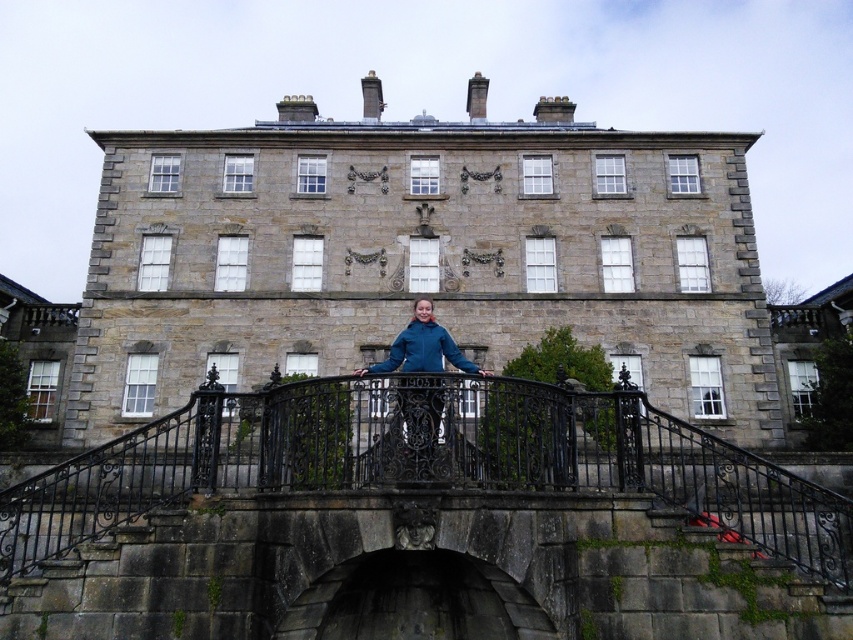
Looking at this image, which of these two, black wrought iron bridge at center or blue fabric jacket at center, stands shorter?

Standing shorter between the two is blue fabric jacket at center.

Who is more forward, (526,444) or (404,340)?

Positioned in front is point (526,444).

The image size is (853, 640). I want to click on black wrought iron bridge at center, so pos(424,460).

Which is above, black wrought iron bridge at center or blue fleece jacket at center?

Positioned higher is blue fleece jacket at center.

Can you confirm if black wrought iron bridge at center is shorter than blue fleece jacket at center?

Incorrect, black wrought iron bridge at center's height does not fall short of blue fleece jacket at center's.

Between point (61, 465) and point (437, 344), which one is positioned behind?

The point (437, 344) is behind.

Find the location of a particular element. black wrought iron bridge at center is located at coordinates (424, 460).

Consider the image. Is blue fabric jacket at center wider than blue fleece jacket at center?

In fact, blue fabric jacket at center might be narrower than blue fleece jacket at center.

Is point (398, 349) positioned behind point (416, 346)?

Yes, it is.

Is point (395, 442) behind point (418, 369)?

No, (395, 442) is in front of (418, 369).

This screenshot has width=853, height=640. What are the coordinates of `blue fabric jacket at center` in the screenshot? It's located at tap(416, 426).